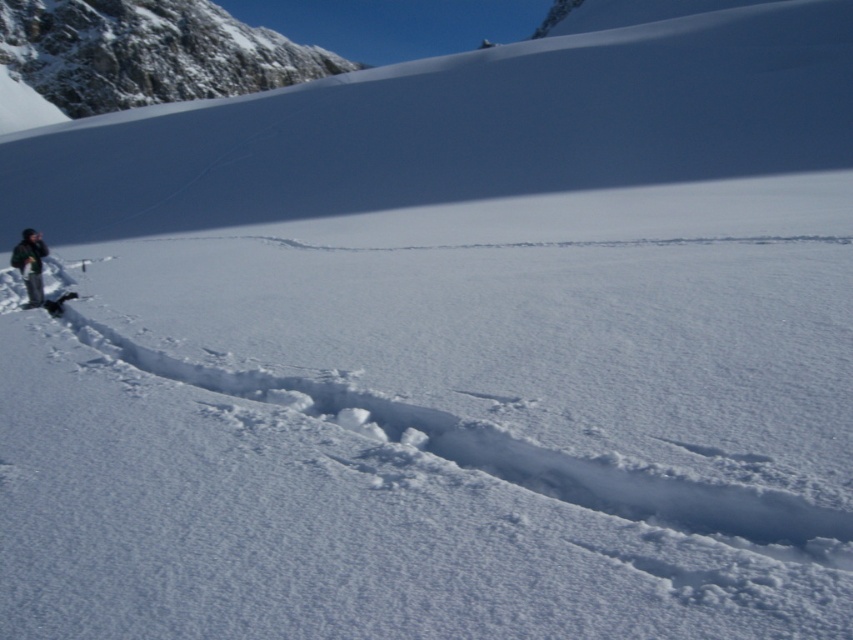
You are a photographer trying to capture the tracks in the snow. You have a black fabric jacket at left and a black matte ski at left. Which object is closer to the center of the image where the tracks lead?

The black matte ski at left is closer to the center of the image where the tracks lead because the black fabric jacket at left is positioned to the left of it, meaning the ski is between the jacket and the center.

You are a photographer trying to capture the tracks leading away from the person. You have a black matte ski at left and a black fabric jacket at left in your viewfinder. Which object is closer to the camera?

The black fabric jacket at left is closer to the camera because the black matte ski at left is behind it.